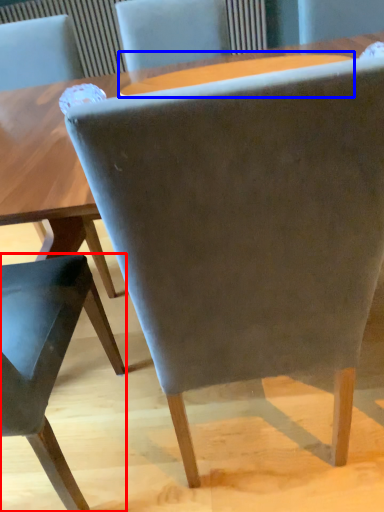
Question: Which of the following is the closest to the observer, chair (highlighted by a red box) or round table (highlighted by a blue box)?

Choices:
 (A) chair
 (B) round table

Answer: (A)